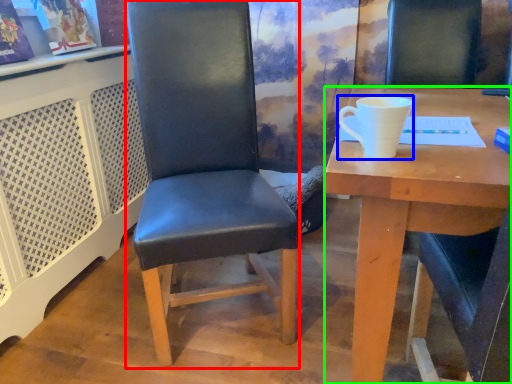
Question: Estimate the real-world distances between objects in this image. Which object is closer to chair (highlighted by a red box), coffee cup (highlighted by a blue box) or desk (highlighted by a green box)?

Choices:
 (A) coffee cup
 (B) desk

Answer: (B)